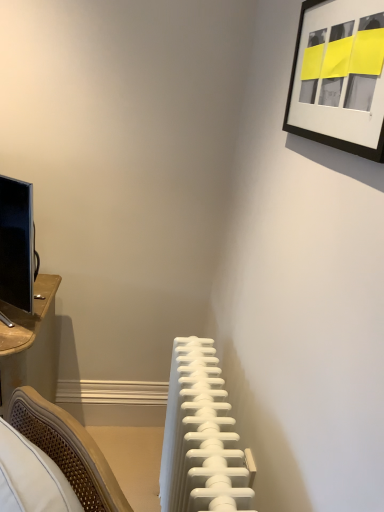
Question: Considering the relative positions of black matte picture frame at upper right and white plastic radiator at center in the image provided, is black matte picture frame at upper right in front of white plastic radiator at center?

Choices:
 (A) no
 (B) yes

Answer: (B)

Question: From the image's perspective, is black matte picture frame at upper right on top of white plastic radiator at center?

Choices:
 (A) no
 (B) yes

Answer: (B)

Question: Does black matte picture frame at upper right appear on the left side of white plastic radiator at center?

Choices:
 (A) yes
 (B) no

Answer: (B)

Question: From the image's perspective, would you say black matte picture frame at upper right is shown under white plastic radiator at center?

Choices:
 (A) yes
 (B) no

Answer: (B)

Question: Can we say black matte picture frame at upper right lies outside white plastic radiator at center?

Choices:
 (A) no
 (B) yes

Answer: (B)

Question: Considering the relative sizes of black matte picture frame at upper right and white plastic radiator at center in the image provided, is black matte picture frame at upper right shorter than white plastic radiator at center?

Choices:
 (A) yes
 (B) no

Answer: (A)

Question: Is white plastic radiator at center far from black matte picture frame at upper right?

Choices:
 (A) no
 (B) yes

Answer: (A)

Question: Is black matte picture frame at upper right at the back of white plastic radiator at center?

Choices:
 (A) no
 (B) yes

Answer: (A)

Question: Is white plastic radiator at center positioned before black matte picture frame at upper right?

Choices:
 (A) no
 (B) yes

Answer: (A)

Question: Considering the relative sizes of white plastic radiator at center and black matte picture frame at upper right in the image provided, is white plastic radiator at center bigger than black matte picture frame at upper right?

Choices:
 (A) no
 (B) yes

Answer: (B)

Question: Can you confirm if white plastic radiator at center is thinner than black matte picture frame at upper right?

Choices:
 (A) yes
 (B) no

Answer: (B)

Question: Does white plastic radiator at center have a greater height compared to black matte picture frame at upper right?

Choices:
 (A) no
 (B) yes

Answer: (B)

Question: Is white plastic radiator at center in front of or behind black matte picture frame at upper right in the image?

Choices:
 (A) behind
 (B) front

Answer: (A)